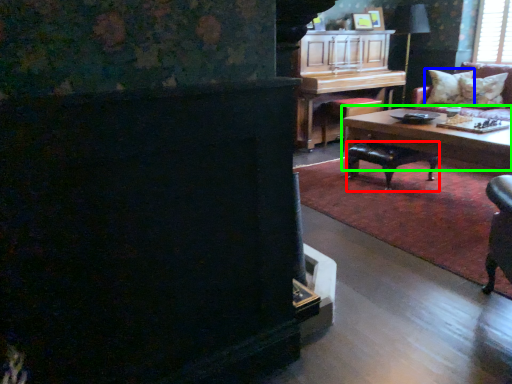
Question: Estimate the real-world distances between objects in this image. Which object is farther from stool (highlighted by a red box), pillow (highlighted by a blue box) or coffee table (highlighted by a green box)?

Choices:
 (A) pillow
 (B) coffee table

Answer: (A)